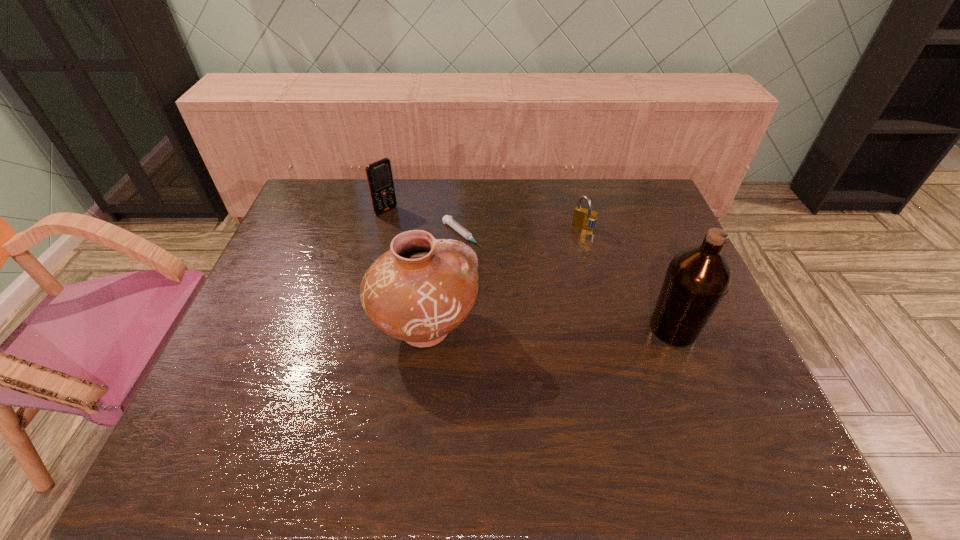
Find the location of `vacant space on the desktop that is between the pottery and the olive oil and is positioned on the side with the combination dials of the fourth tallest object`. vacant space on the desktop that is between the pottery and the olive oil and is positioned on the side with the combination dials of the fourth tallest object is located at coordinates (530, 328).

Locate an element on the screen. vacant space on the desktop that is between the pottery and the rightmost object and is positioned on the screen of the cellular telephone is located at coordinates (534, 328).

At what (x,y) coordinates should I click in order to perform the action: click on vacant space on the desktop that is between the pottery and the rightmost object and is positioned at the needle end of the syringe. Please return your answer as a coordinate pair (x, y). Looking at the image, I should click on (579, 328).